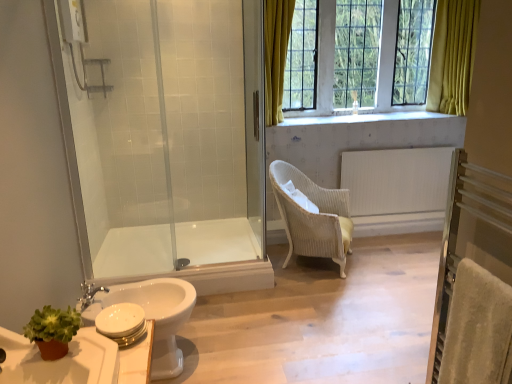
Question: Can you confirm if beige wicker chair at center is positioned to the right of white matte toilet paper at lower left?

Choices:
 (A) no
 (B) yes

Answer: (B)

Question: Does beige wicker chair at center have a greater width compared to white matte toilet paper at lower left?

Choices:
 (A) yes
 (B) no

Answer: (A)

Question: Is beige wicker chair at center aimed at white matte toilet paper at lower left?

Choices:
 (A) yes
 (B) no

Answer: (B)

Question: From the image's perspective, would you say beige wicker chair at center is positioned over white matte toilet paper at lower left?

Choices:
 (A) no
 (B) yes

Answer: (B)

Question: Is beige wicker chair at center located outside white matte toilet paper at lower left?

Choices:
 (A) no
 (B) yes

Answer: (B)

Question: Considering the relative sizes of beige wicker chair at center and white matte toilet paper at lower left in the image provided, is beige wicker chair at center thinner than white matte toilet paper at lower left?

Choices:
 (A) yes
 (B) no

Answer: (B)

Question: Is white textured radiator at center right closer to the viewer compared to silver metallic faucet at lower left?

Choices:
 (A) yes
 (B) no

Answer: (B)

Question: Is white textured radiator at center right further to camera compared to silver metallic faucet at lower left?

Choices:
 (A) yes
 (B) no

Answer: (A)

Question: Is white textured radiator at center right turned away from silver metallic faucet at lower left?

Choices:
 (A) no
 (B) yes

Answer: (A)

Question: From a real-world perspective, is white textured radiator at center right on silver metallic faucet at lower left?

Choices:
 (A) yes
 (B) no

Answer: (B)

Question: Does white textured radiator at center right have a greater width compared to silver metallic faucet at lower left?

Choices:
 (A) yes
 (B) no

Answer: (B)

Question: From the image's perspective, would you say white textured radiator at center right is shown under silver metallic faucet at lower left?

Choices:
 (A) no
 (B) yes

Answer: (A)

Question: Does green matte plant at lower left have a smaller size compared to white glossy toilet at lower left?

Choices:
 (A) yes
 (B) no

Answer: (A)